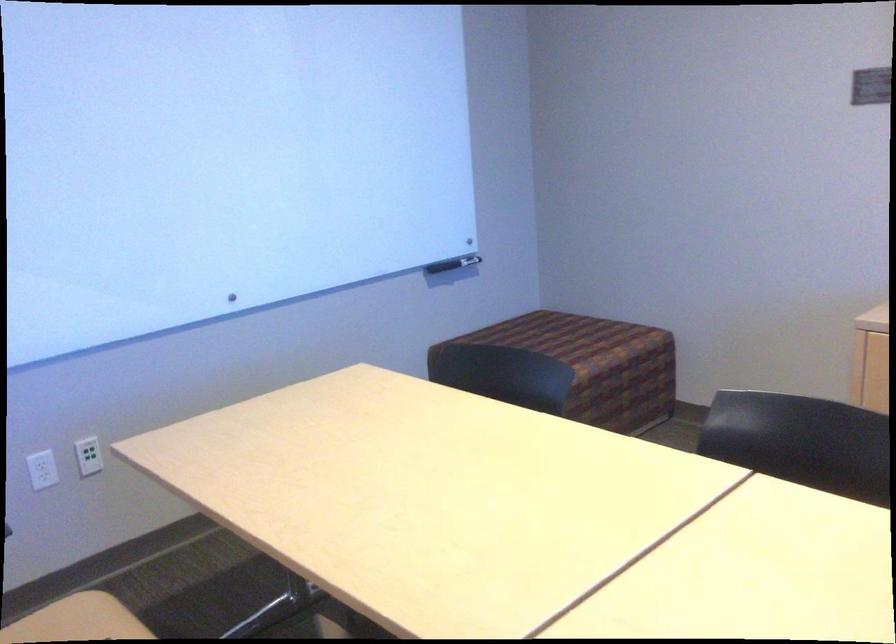
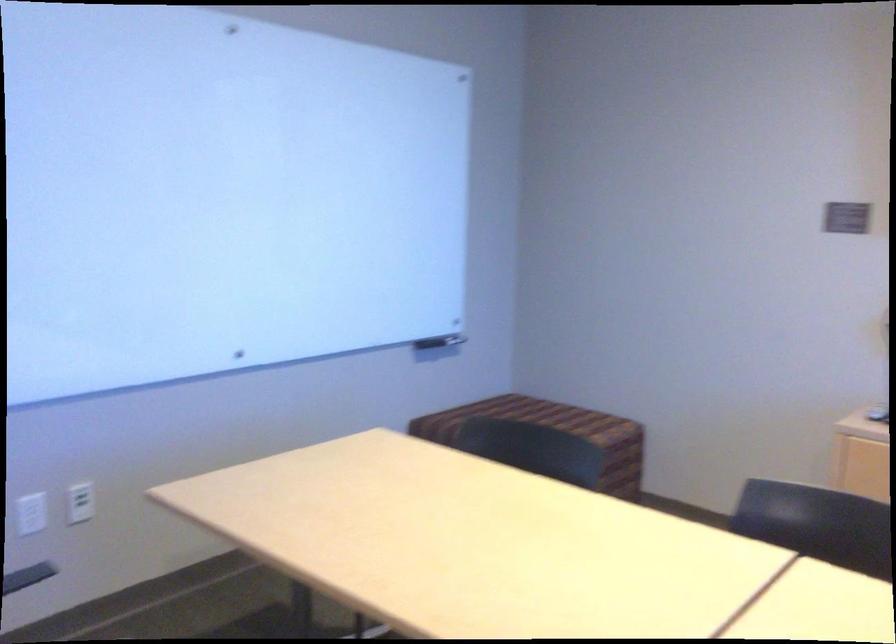
The point at (633, 395) is marked in the first image. Where is the corresponding point in the second image?

(607, 482)